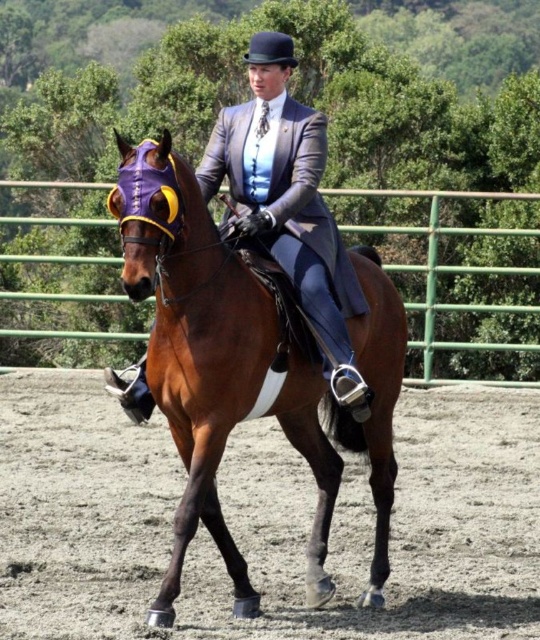
Question: Which object is the closest to the green metal fence at center?

Choices:
 (A) brown glossy horse at center
 (B) brown sandy dirt track at center

Answer: (B)

Question: Which object is closer to the camera taking this photo?

Choices:
 (A) green metal fence at center
 (B) brown sandy dirt track at center
 (C) brown glossy horse at center

Answer: (C)

Question: Is brown sandy dirt track at center below brown glossy horse at center?

Choices:
 (A) yes
 (B) no

Answer: (A)

Question: Which point is farther to the camera?

Choices:
 (A) brown glossy horse at center
 (B) brown sandy dirt track at center
 (C) green metal fence at center

Answer: (C)

Question: Does brown glossy horse at center appear under green metal fence at center?

Choices:
 (A) yes
 (B) no

Answer: (A)

Question: Is brown sandy dirt track at center to the left of brown glossy horse at center from the viewer's perspective?

Choices:
 (A) no
 (B) yes

Answer: (B)